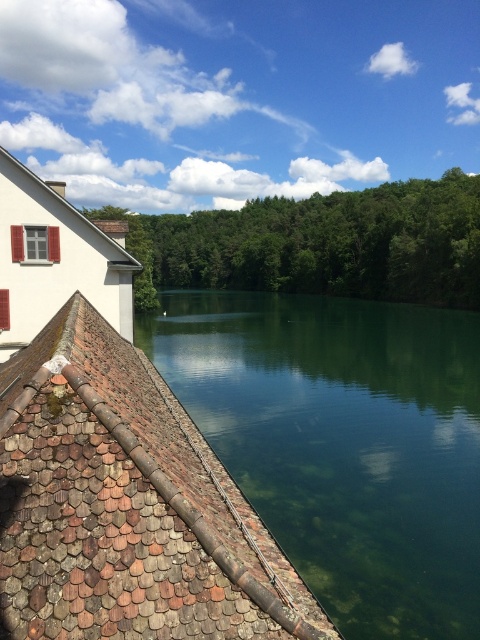
Is green glassy water at center below brown tile roof at lower left?

No.

The image size is (480, 640). I want to click on green glassy water at center, so click(x=344, y=442).

The width and height of the screenshot is (480, 640). I want to click on green glassy water at center, so click(x=344, y=442).